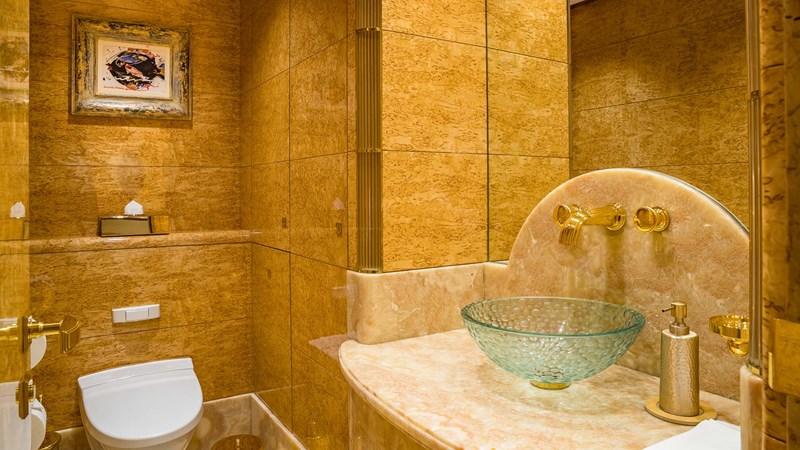
The image size is (800, 450). I want to click on painting, so click(x=126, y=73).